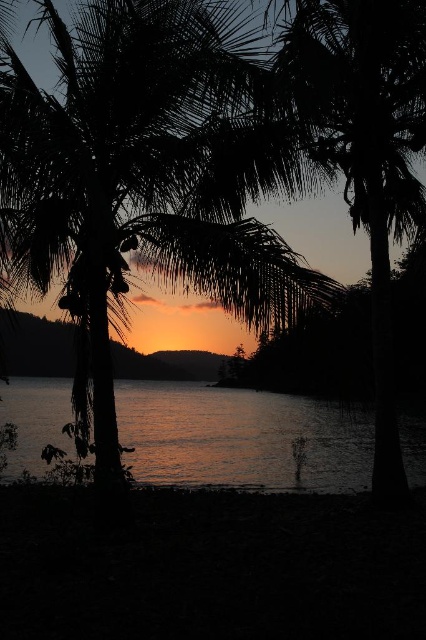
You are an artist trying to sketch this sunset scene. You want to ensure the silhouette leafy palm at center and the glistening water at center are proportionally accurate. Which object should you draw larger?

The silhouette leafy palm at center should be drawn larger since it is bigger than the glistening water at center according to the description.

You are standing at the shore looking at the silhouette leafy palm at center and the glistening water at center. Which object is taller?

The silhouette leafy palm at center is taller than the glistening water at center.

You are standing at the point with coordinates point (146, 177) in the image. What object are you currently standing on?

You are standing on the silhouette leafy palm at center.